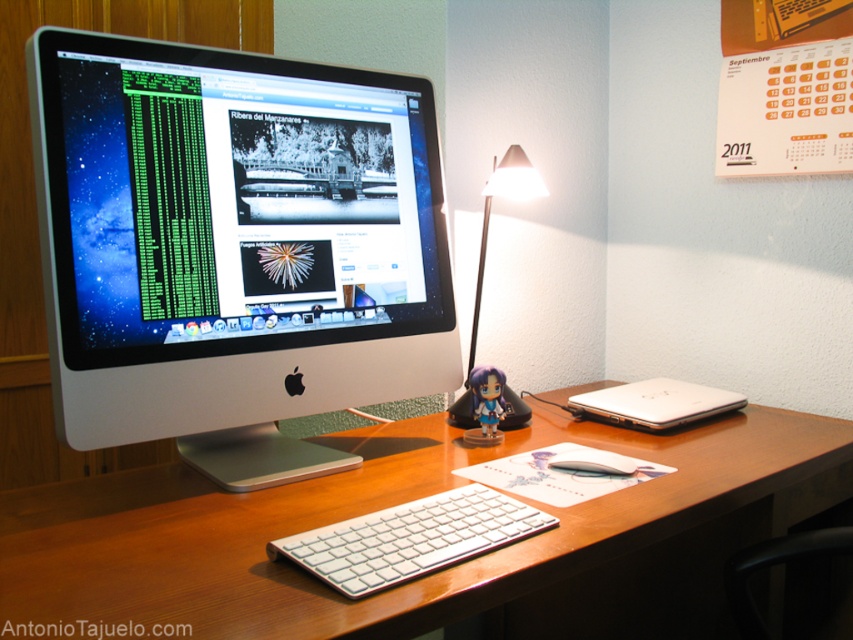
Question: Estimate the real-world distances between objects in this image. Which object is closer to the white plastic monitor at center?

Choices:
 (A) white matte mouse at center
 (B) white wood computer desk at center
 (C) matte plastic figurine at center
 (D) white aluminum keyboard at center

Answer: (B)

Question: Which object is closer to the camera taking this photo?

Choices:
 (A) white matte mouse at center
 (B) white wood computer desk at center

Answer: (B)

Question: Can you confirm if matte black desk lamp at center is thinner than white matte mouse at center?

Choices:
 (A) no
 (B) yes

Answer: (A)

Question: Can you confirm if matte black desk lamp at center is wider than matte plastic figurine at center?

Choices:
 (A) yes
 (B) no

Answer: (A)

Question: Can you confirm if matte black desk lamp at center is bigger than matte plastic figurine at center?

Choices:
 (A) no
 (B) yes

Answer: (B)

Question: Which of these objects is positioned closest to the matte black desk lamp at center?

Choices:
 (A) white plastic monitor at center
 (B) matte plastic figurine at center
 (C) white aluminum keyboard at center
 (D) white wood computer desk at center

Answer: (B)